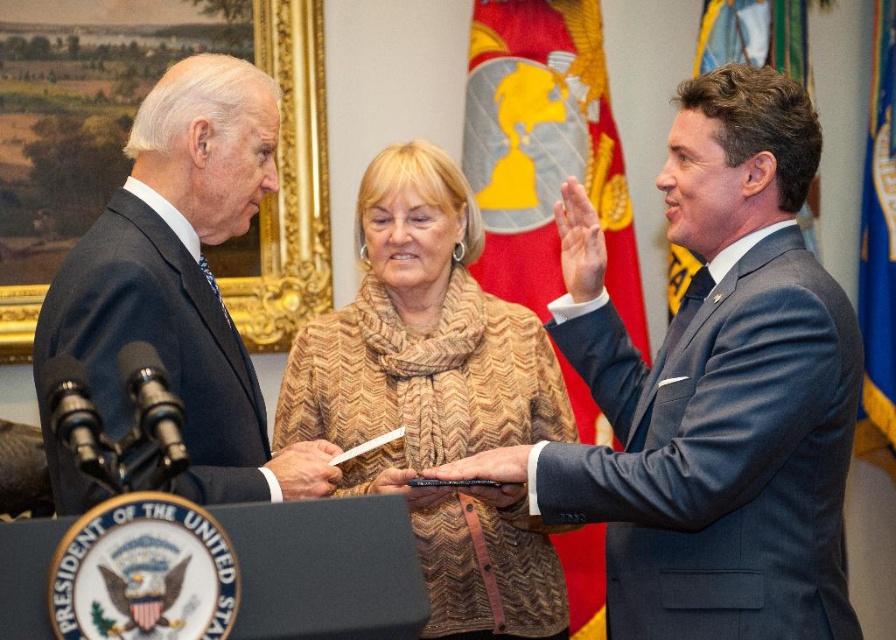
You are a photographer positioned behind the dark blue wool suit at left and need to capture a closeup shot of the smooth leather pen at center. Given that your camera has a minimum focusing distance of 1.5 meters, will you be able to take the photo without moving closer?

The distance between the dark blue wool suit at left and the smooth leather pen at center is 1.60 meters. Since your camera requires a minimum focusing distance of 1.5 meters, you are just within range to take the closeup shot without needing to move closer.

Consider the image. You are a photographer standing at the camera position. You need to capture a closeup shot of the matte gray suit at right. Given that your camera has a minimum focusing distance of 10 feet, will you be able to take the photo without moving closer?

The distance between the matte gray suit at right and the camera is 15.84 feet, which is greater than the minimum focusing distance of 10 feet. Therefore, you can take the closeup shot without moving closer.